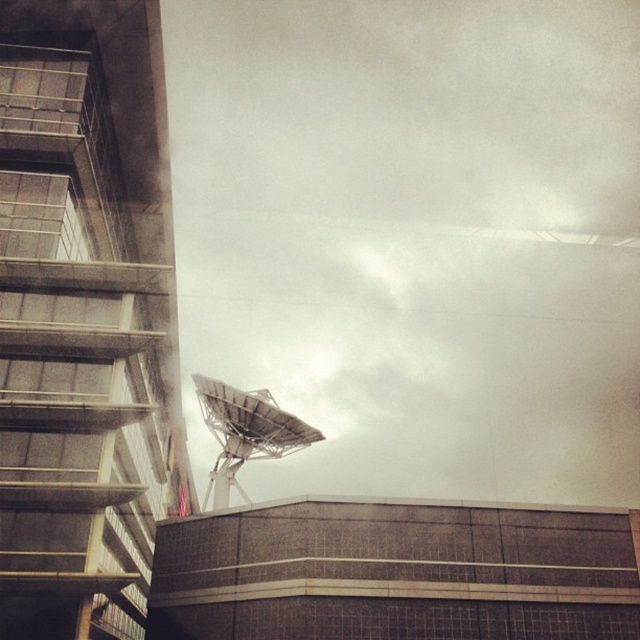
You are an architect designing a new building and want to ensure that the white matte satellite dish at center does not block the view of the metallic satellite dish at lower center from the street level. Based on their sizes, is this feasible?

The white matte satellite dish at center is much taller than the metallic satellite dish at lower center. Since the taller dish is positioned at the center, it might block the view of the lower one from street level depending on their exact placement and angles, but based on size alone, the taller dish could potentially obscure the smaller one.

You are a technician who needs to place a new satellite dish that is 10 feet wide. You see the white matte satellite dish at center and the metallic satellite dish at lower center. Can you fit the new dish between them without overlapping?

The distance between the white matte satellite dish at center and the metallic satellite dish at lower center is 208.63 feet. Since the new dish is only 10 feet wide, there is sufficient space between them to place the new dish without overlapping.

You are standing in front of a building and see the white matte satellite dish at center and the metallic satellite dish at lower center. Which satellite dish is positioned to the right of the other?

The white matte satellite dish at center is positioned to the right of the metallic satellite dish at lower center.